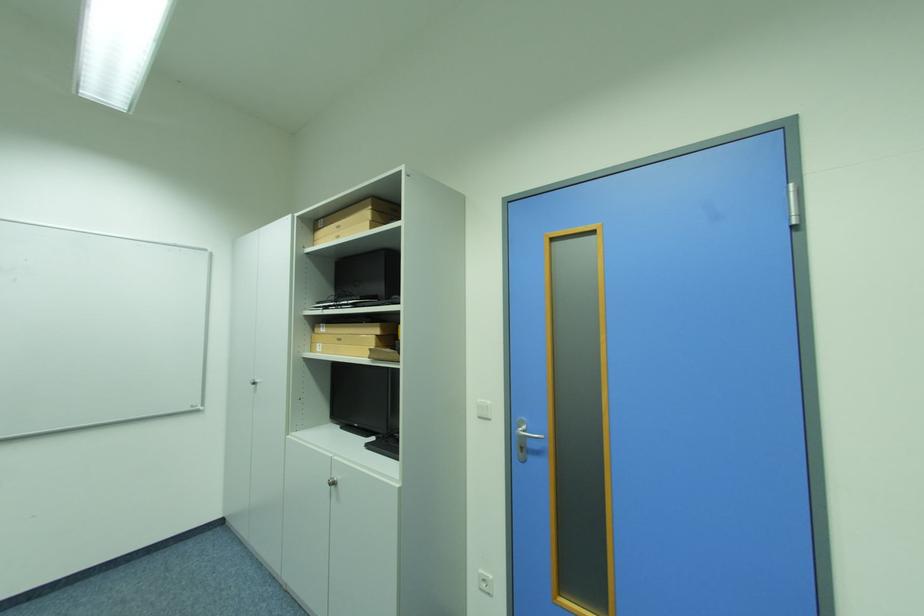
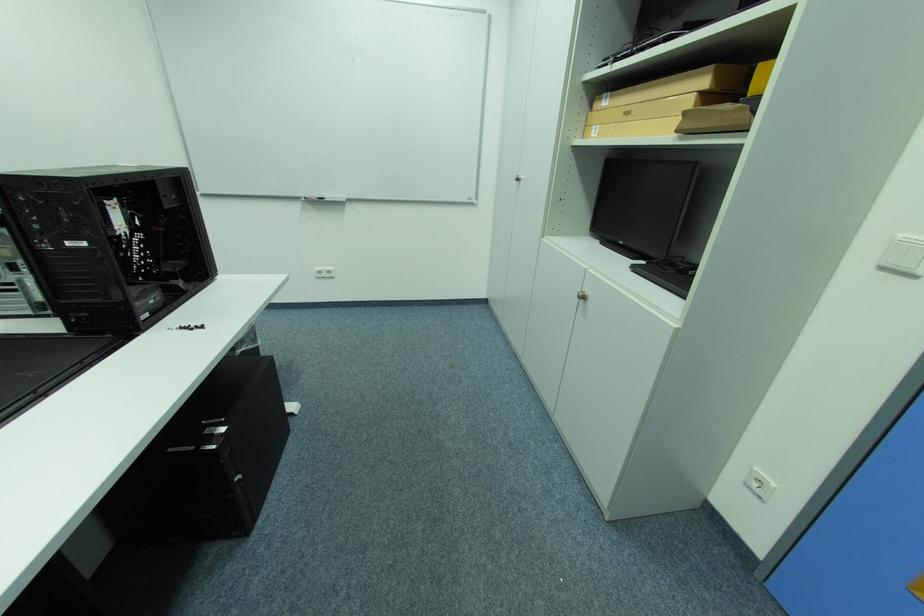
The point at (337, 485) is marked in the first image. Where is the corresponding point in the second image?

(587, 297)